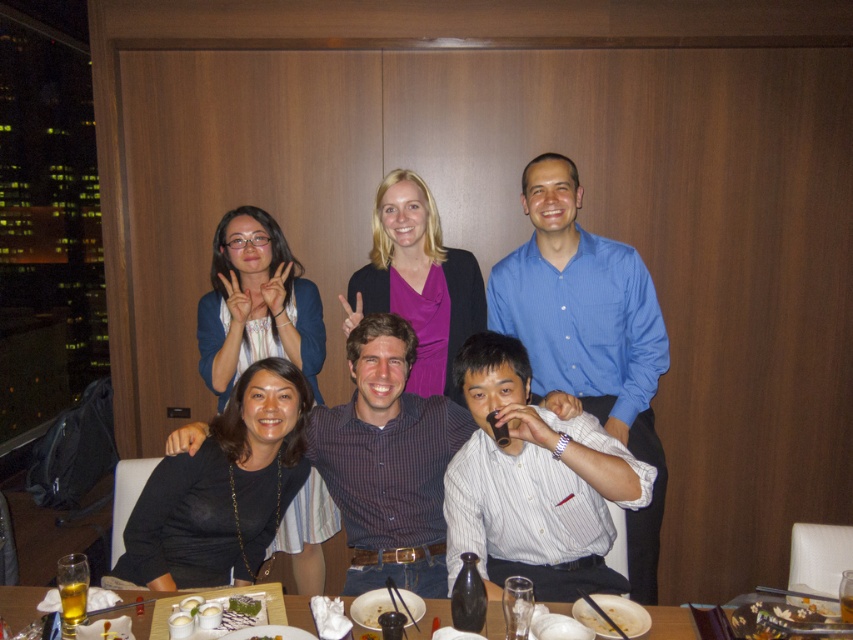
Question: Is purple matte shirt at center to the left of white porcelain bowl at lower center from the viewer's perspective?

Choices:
 (A) no
 (B) yes

Answer: (B)

Question: Which object is farther from the camera taking this photo?

Choices:
 (A) matte black shirt at center
 (B) matte blue sweater at upper left

Answer: (B)

Question: Among these points, which one is farthest from the camera?

Choices:
 (A) (445, 621)
 (B) (202, 624)
 (C) (581, 616)

Answer: (C)

Question: Does matte black shirt at center come behind white glossy bowl at lower center?

Choices:
 (A) yes
 (B) no

Answer: (A)

Question: Is matte blue sweater at upper left bigger than white porcelain bowl at lower center?

Choices:
 (A) yes
 (B) no

Answer: (A)

Question: Based on their relative distances, which object is farther from the matte blue sweater at upper left?

Choices:
 (A) matte black shirt at center
 (B) purple matte shirt at center
 (C) white porcelain bowl at lower center
 (D) white glossy bowl at lower center

Answer: (C)